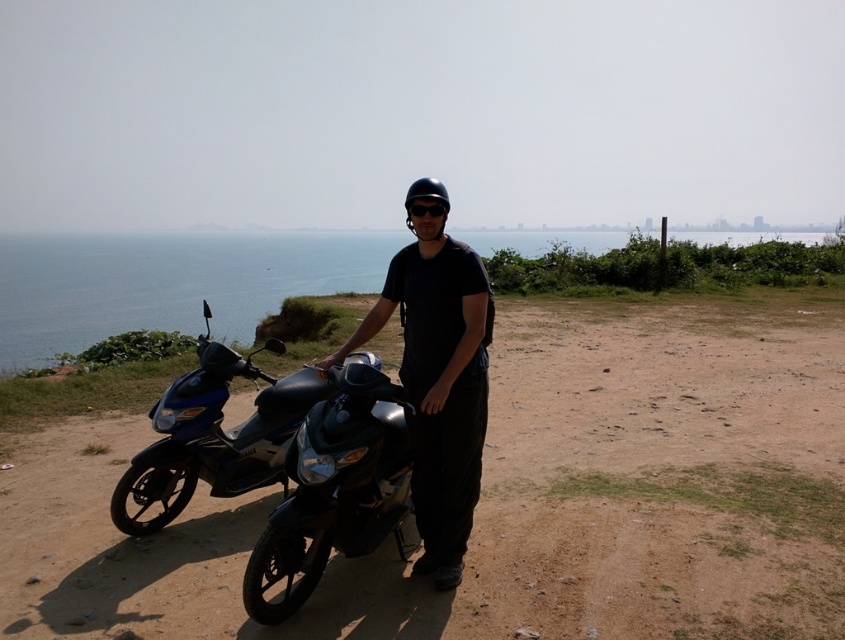
Question: Among these points, which one is farthest from the camera?

Choices:
 (A) (680, 609)
 (B) (277, 397)

Answer: (B)

Question: Which point is closer to the camera?

Choices:
 (A) blue glossy scooter at left
 (B) black matte shirt at center

Answer: (B)

Question: Does blue water at center have a larger size compared to blue glossy scooter at left?

Choices:
 (A) yes
 (B) no

Answer: (A)

Question: From the image, what is the correct spatial relationship of black matte shirt at center in relation to black glossy motorcycle at center?

Choices:
 (A) left
 (B) right

Answer: (B)

Question: Is blue water at center thinner than black glossy motorcycle at center?

Choices:
 (A) no
 (B) yes

Answer: (A)

Question: Which point is farther from the camera taking this photo?

Choices:
 (A) (712, 576)
 (B) (476, 403)
 (C) (522, 236)
 (D) (369, 401)

Answer: (C)